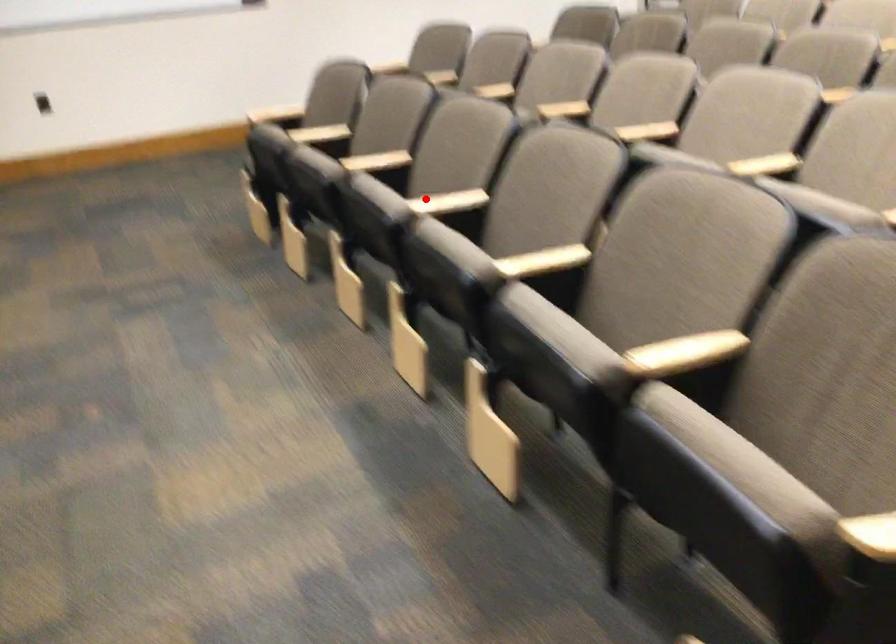
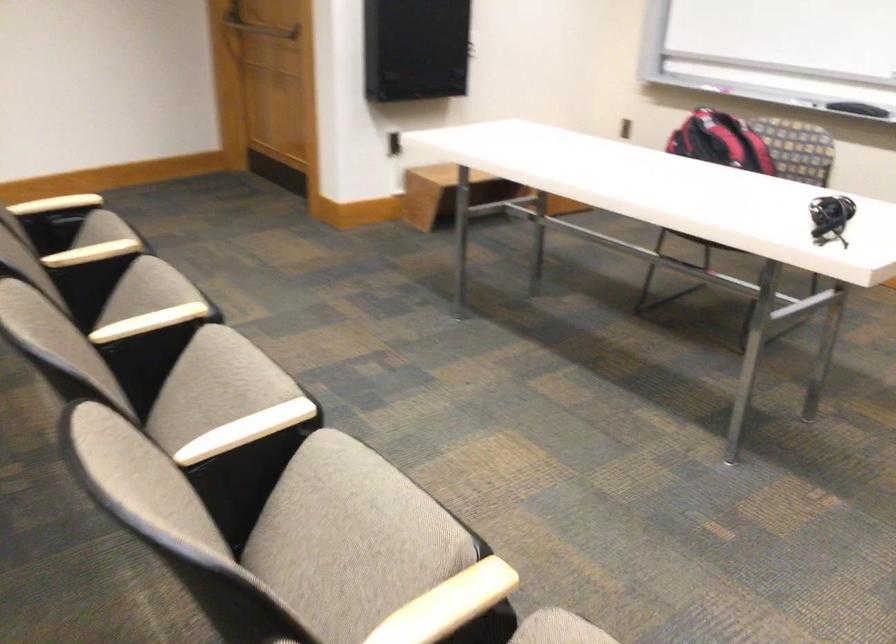
Where in the second image is the point corresponding to the highlighted location from the first image?

(245, 430)